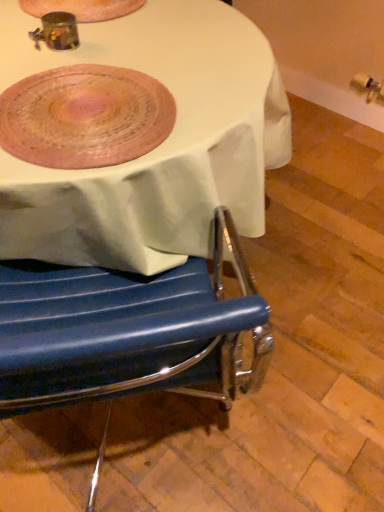
At what (x,y) coordinates should I click in order to perform the action: click on free spot behind pink woven platter at upper left. Please return your answer as a coordinate pair (x, y). This screenshot has width=384, height=512. Looking at the image, I should click on (133, 46).